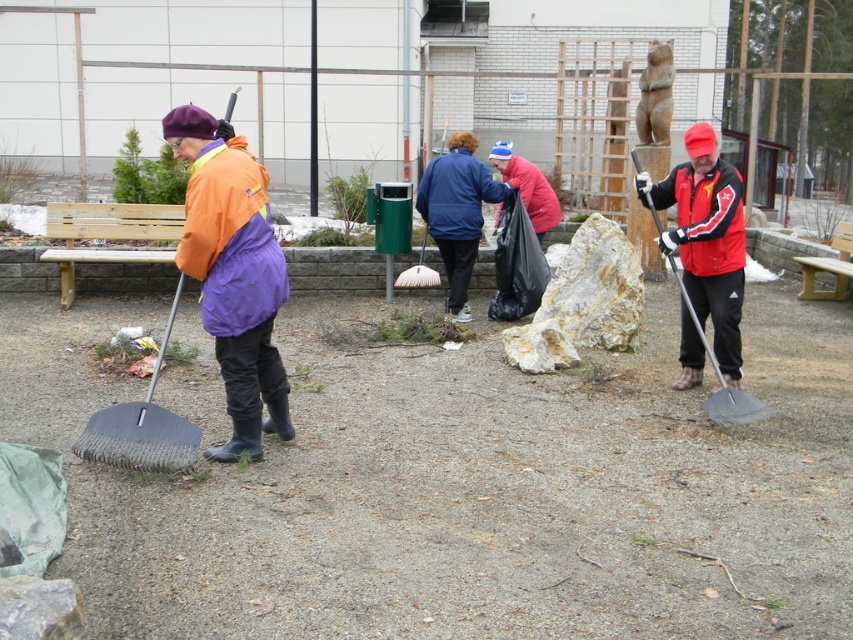
You are a park maintenance worker who needs to use the dark gray rubber shovel at left to clear debris. However, the red matte jacket at center is blocking your access to it. Can you move the shovel without moving the jacket?

The dark gray rubber shovel at left is positioned under the red matte jacket at center, so you cannot access it without moving the jacket first.

Please look at the coordinates point at (x=231, y=275). What object is located there?

The orange matte jacket at left is located at the coordinates point at (x=231, y=275).

You are a park maintenance worker who needs to retrieve a tool from the ground. You see the blue fabric jacket at center and the matte black shovel at right. Which object is located to the left of the other?

The blue fabric jacket at center is positioned on the left side of matte black shovel at right.